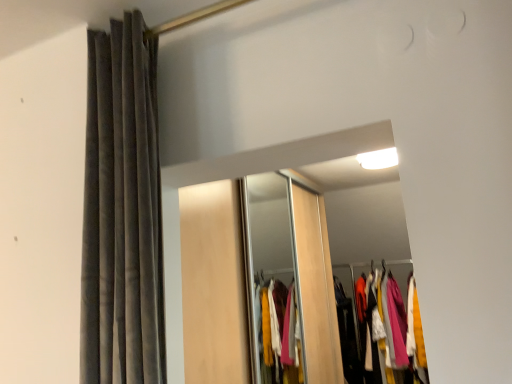
The width and height of the screenshot is (512, 384). Describe the element at coordinates (388, 320) in the screenshot. I see `velvet-like fabric coat at center` at that location.

Identify the location of velvet-like fabric coat at center. (388, 320).

In order to face velvet-like fabric coat at center, should I rotate leftwards or rightwards?

To align with it, rotate right about 18.056°.

Image resolution: width=512 pixels, height=384 pixels. I want to click on velvet-like fabric coat at center, so click(x=388, y=320).